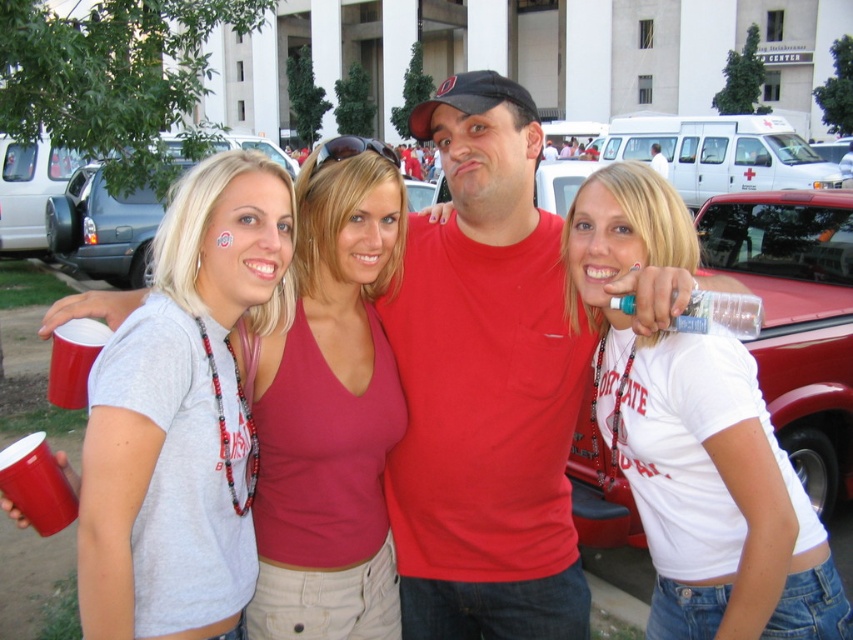
Does matte red t-shirt at center have a greater width compared to matte red tank top at center?

Correct, the width of matte red t-shirt at center exceeds that of matte red tank top at center.

Does matte red t-shirt at center come behind matte red tank top at center?

Yes, it is behind matte red tank top at center.

Who is more forward, [473,186] or [399,230]?

Positioned in front is point [473,186].

Where is `matte red t-shirt at center`? The height and width of the screenshot is (640, 853). matte red t-shirt at center is located at coordinates (485, 385).

Does matte gray t-shirt at center come in front of matte red tank top at center?

Yes, it is.

Does matte gray t-shirt at center have a greater height compared to matte red tank top at center?

Yes.

Between point (358, 632) and point (310, 166), which one is positioned in front?

Point (358, 632)

Where is `matte gray t-shirt at center`? matte gray t-shirt at center is located at coordinates (331, 408).

Which is above, matte gray t-shirt at center or metallic silver car at left?

metallic silver car at left is above.

Between point (245, 368) and point (90, 221), which one is positioned in front?

Positioned in front is point (245, 368).

Identify the location of matte gray t-shirt at center. The height and width of the screenshot is (640, 853). (331, 408).